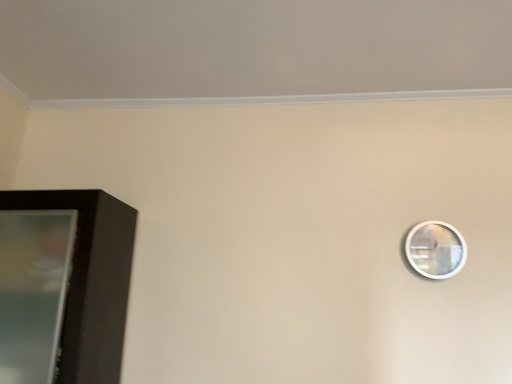
Locate an element on the screen. The height and width of the screenshot is (384, 512). silver metallic mirror at upper right is located at coordinates (435, 249).

What do you see at coordinates (435, 249) in the screenshot? I see `silver metallic mirror at upper right` at bounding box center [435, 249].

Describe the element at coordinates (63, 285) in the screenshot. I see `black glossy cabinet at left` at that location.

This screenshot has width=512, height=384. Find the location of `black glossy cabinet at left`. black glossy cabinet at left is located at coordinates (63, 285).

Find the location of a particular element. The height and width of the screenshot is (384, 512). silver metallic mirror at upper right is located at coordinates (435, 249).

In the image, is black glossy cabinet at left on the left side or the right side of silver metallic mirror at upper right?

In the image, black glossy cabinet at left appears on the left side of silver metallic mirror at upper right.

Is the position of black glossy cabinet at left more distant than that of silver metallic mirror at upper right?

No.

Which is closer to the camera, [95,273] or [436,252]?

Clearly, point [95,273] is closer to the camera than point [436,252].

From the image's perspective, is black glossy cabinet at left under silver metallic mirror at upper right?

Answer: Indeed, from the image's perspective, black glossy cabinet at left is shown beneath silver metallic mirror at upper right.

From a real-world perspective, is black glossy cabinet at left on silver metallic mirror at upper right?

No, from a real-world perspective, black glossy cabinet at left is not above silver metallic mirror at upper right.

Is black glossy cabinet at left wider or thinner than silver metallic mirror at upper right?

In the image, black glossy cabinet at left appears to be wider than silver metallic mirror at upper right.

Who is shorter, black glossy cabinet at left or silver metallic mirror at upper right?

silver metallic mirror at upper right is shorter.

Between black glossy cabinet at left and silver metallic mirror at upper right, which one has larger size?

black glossy cabinet at left is bigger.

Is black glossy cabinet at left spatially inside silver metallic mirror at upper right, or outside of it?

black glossy cabinet at left is not enclosed by silver metallic mirror at upper right.

Is the surface of black glossy cabinet at left in direct contact with silver metallic mirror at upper right?

black glossy cabinet at left and silver metallic mirror at upper right are clearly separated.

Is black glossy cabinet at left looking in the opposite direction of silver metallic mirror at upper right?

No, black glossy cabinet at left's orientation is not away from silver metallic mirror at upper right.

How different are the orientations of black glossy cabinet at left and silver metallic mirror at upper right in degrees?

1.12 degrees separate the facing orientations of black glossy cabinet at left and silver metallic mirror at upper right.

How much distance is there between black glossy cabinet at left and silver metallic mirror at upper right?

A distance of 1.43 meters exists between black glossy cabinet at left and silver metallic mirror at upper right.

In order to click on furniture located underneath the silver metallic mirror at upper right (from a real-world perspective) in this screenshot , I will do `click(63, 285)`.

Is silver metallic mirror at upper right at the left side of black glossy cabinet at left?

No.

Which object is further away from the camera, silver metallic mirror at upper right or black glossy cabinet at left?

silver metallic mirror at upper right is further away from the camera.

Is point (452, 263) more distant than point (47, 211)?

That is True.

From the image's perspective, is silver metallic mirror at upper right below black glossy cabinet at left?

No, from the image's perspective, silver metallic mirror at upper right is not below black glossy cabinet at left.

From a real-world perspective, is silver metallic mirror at upper right positioned under black glossy cabinet at left based on gravity?

Actually, silver metallic mirror at upper right is physically above black glossy cabinet at left in the real world.

Is silver metallic mirror at upper right thinner than black glossy cabinet at left?

Indeed, silver metallic mirror at upper right has a lesser width compared to black glossy cabinet at left.

Which of these two, silver metallic mirror at upper right or black glossy cabinet at left, stands taller?

Standing taller between the two is black glossy cabinet at left.

Who is smaller, silver metallic mirror at upper right or black glossy cabinet at left?

Smaller between the two is silver metallic mirror at upper right.

Can black glossy cabinet at left be found inside silver metallic mirror at upper right?

No, black glossy cabinet at left is located outside of silver metallic mirror at upper right.

Are silver metallic mirror at upper right and black glossy cabinet at left beside each other?

No, silver metallic mirror at upper right is not next to black glossy cabinet at left.

Could you tell me if silver metallic mirror at upper right is turned towards black glossy cabinet at left?

No, silver metallic mirror at upper right is not oriented towards black glossy cabinet at left.

How different are the orientations of silver metallic mirror at upper right and black glossy cabinet at left in degrees?

The angle between the facing direction of silver metallic mirror at upper right and the facing direction of black glossy cabinet at left is 1.12 degrees.

Identify the location of mirror that appears above the black glossy cabinet at left (from a real-world perspective). The width and height of the screenshot is (512, 384). (435, 249).

I want to click on furniture to the left of silver metallic mirror at upper right, so click(x=63, y=285).

The width and height of the screenshot is (512, 384). What are the coordinates of `mirror that is on the right side of black glossy cabinet at left` in the screenshot? It's located at (435, 249).